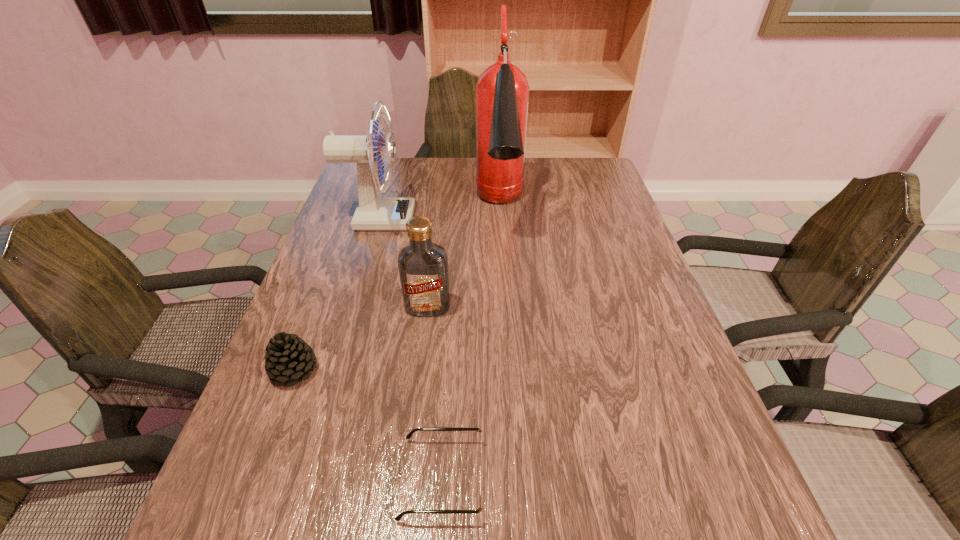
Locate an element on the screen. fire extinguisher is located at coordinates (502, 91).

Where is `the second tallest object`? the second tallest object is located at coordinates (373, 213).

I want to click on the third shortest object, so click(423, 265).

I want to click on vodka, so click(x=423, y=265).

Where is `pinecone`? Image resolution: width=960 pixels, height=540 pixels. pinecone is located at coordinates (287, 358).

Locate an element on the screen. the fourth tallest object is located at coordinates (287, 358).

I want to click on the shortest object, so click(x=481, y=454).

Where is `the nearest object`? the nearest object is located at coordinates (481, 454).

This screenshot has width=960, height=540. I want to click on vacant region located at the nozzle end of the fire extinguisher, so [x=506, y=310].

Find the location of a particular element. This screenshot has width=960, height=540. free space located 0.320m on the front-facing side of the second tallest object is located at coordinates (522, 220).